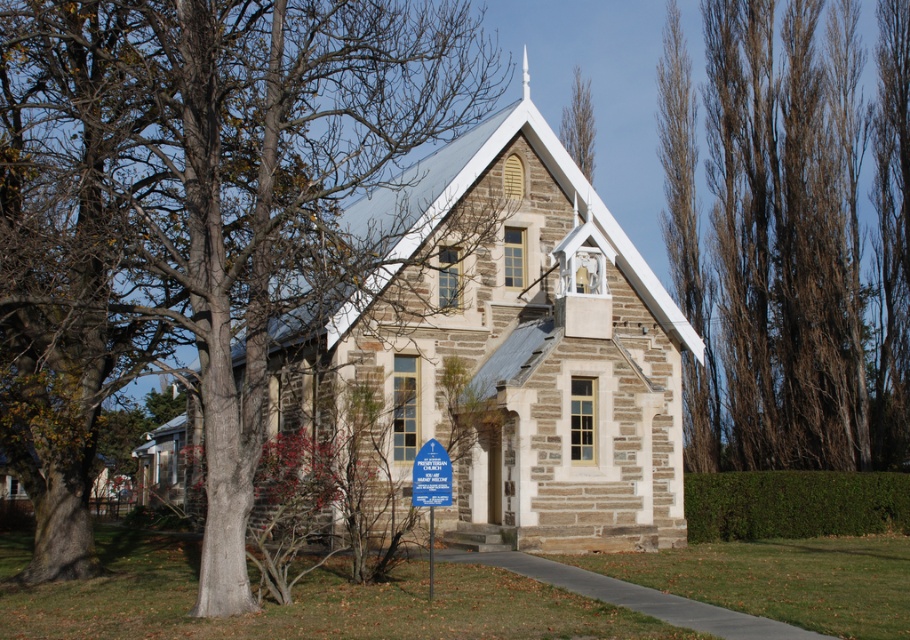
Consider the image. You are standing at the entrance of the church and want to place a new flowerpot between the brown bark tree at upper right and the blue plastic sign at center. Can you determine which object is higher to know where to place the flowerpot?

The brown bark tree at upper right is located above the blue plastic sign at center, so you should place the flowerpot below the brown bark tree at upper right and above the blue plastic sign at center.

You are a painter standing at the base of the brown bark tree at upper right and want to paint the blue plastic sign at center. Since you can only paint objects within your immediate vicinity, which object is closer to you?

The brown bark tree at upper right is closer to you since you are standing at its base, while the blue plastic sign at center is further away.

In the scene shown: You are standing at the entrance of the church and want to place a new sign. The current blue plastic sign at lower center is located at coordinates 0.761, 0.475. Where should you place the new sign so it is directly to the right of the existing one?

The new sign should be placed to the right of the blue plastic sign at lower center, which is currently at coordinates (431, 486). Since the question specifies placing it directly to the right, the new coordinates would be slightly higher in the x value, such as (431, 512).